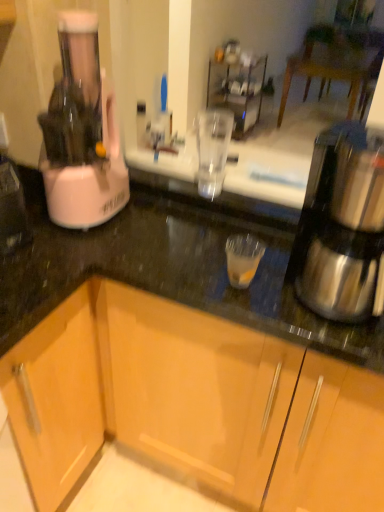
Question: Considering the relative positions of shiny metallic coffee maker at right and wooden cabinet at lower left, which is the 2th cabinetry in right-to-left order, in the image provided, is shiny metallic coffee maker at right to the left or to the right of wooden cabinet at lower left, which is the 2th cabinetry in right-to-left order,?

Choices:
 (A) left
 (B) right

Answer: (B)

Question: Is shiny metallic coffee maker at right inside or outside of wooden cabinet at lower left, which is the 2th cabinetry in right-to-left order?

Choices:
 (A) inside
 (B) outside

Answer: (B)

Question: Which object is the closest to the wooden cabinet at lower left, the first cabinetry in the left-to-right sequence?

Choices:
 (A) white plastic blender at left
 (B) shiny metallic coffee maker at right
 (C) black granite countertop at center
 (D) wooden cabinet at lower center, the 2th cabinetry positioned from the left

Answer: (D)

Question: Considering the real-world distances, which object is farthest from the black granite countertop at center?

Choices:
 (A) wooden cabinet at lower left, the first cabinetry in the left-to-right sequence
 (B) wooden cabinet at lower center, acting as the 1th cabinetry starting from the right
 (C) white plastic blender at left
 (D) shiny metallic coffee maker at right

Answer: (A)